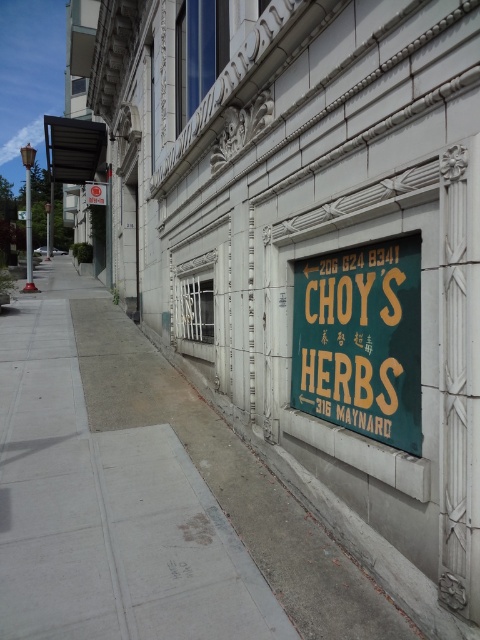
Question: Which point is closer to the camera taking this photo?

Choices:
 (A) (12, 524)
 (B) (324, 417)

Answer: (A)

Question: Which object is farther from the camera taking this photo?

Choices:
 (A) green matte sign at center
 (B) gray concrete sidewalk at lower left

Answer: (A)

Question: Is gray concrete sidewalk at lower left smaller than green matte sign at center?

Choices:
 (A) no
 (B) yes

Answer: (A)

Question: Does gray concrete sidewalk at lower left have a greater width compared to green matte sign at center?

Choices:
 (A) yes
 (B) no

Answer: (A)

Question: Is gray concrete sidewalk at lower left wider than green matte sign at center?

Choices:
 (A) no
 (B) yes

Answer: (B)

Question: Which of the following is the farthest from the observer?

Choices:
 (A) (50, 292)
 (B) (367, 358)

Answer: (A)